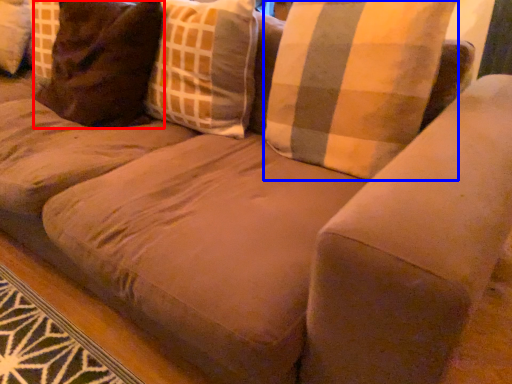
Question: Which object appears farthest to the camera in this image, pillow (highlighted by a red box) or pillow (highlighted by a blue box)?

Choices:
 (A) pillow
 (B) pillow

Answer: (A)